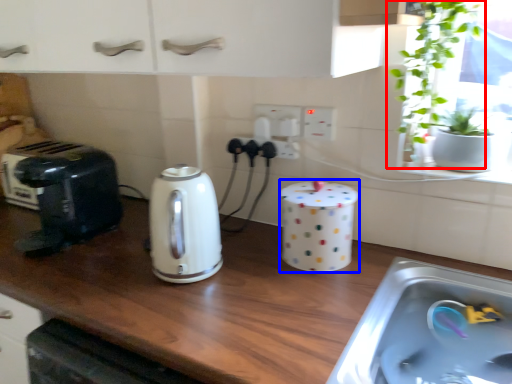
Question: Which point is further to the camera, houseplant (highlighted by a red box) or appliance (highlighted by a blue box)?

Choices:
 (A) houseplant
 (B) appliance

Answer: (B)